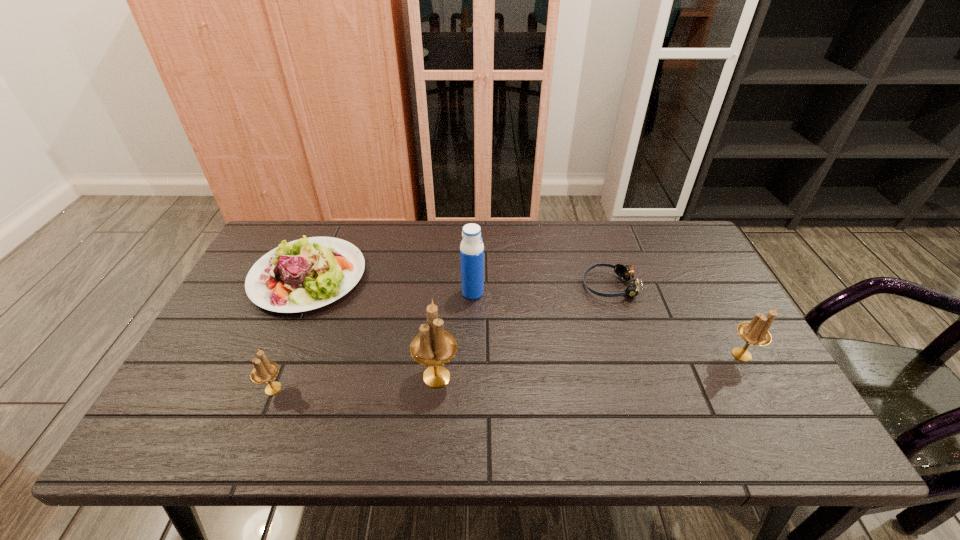
Where is `vacant position for inserting another candle_holder evenly`? vacant position for inserting another candle_holder evenly is located at coordinates (592, 366).